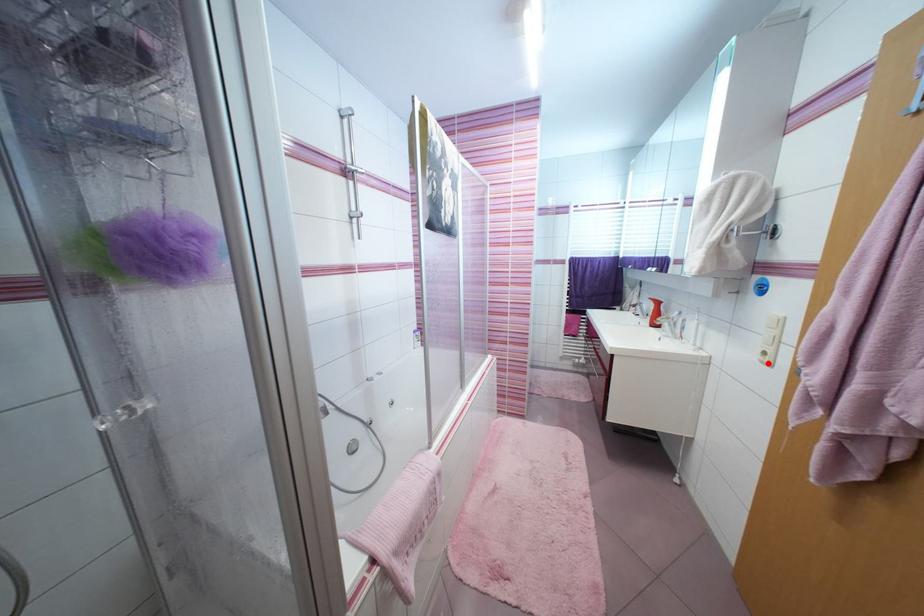
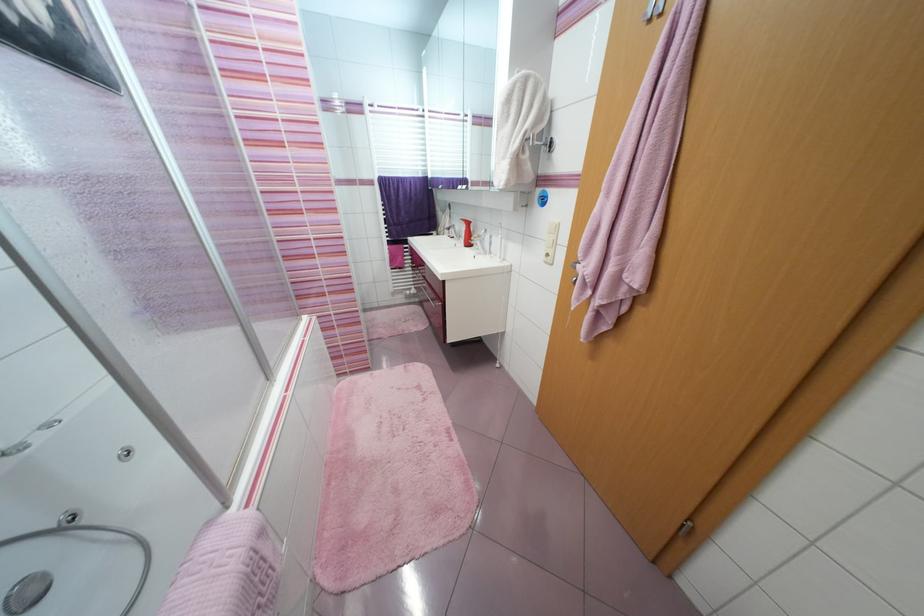
Question: I am providing you with two images of the same scene from different viewpoints. Given a red point in image1, look at the same physical point in image2. Is it:

Choices:
 (A) Closer to the viewpoint
 (B) Farther from the viewpoint

Answer: (A)